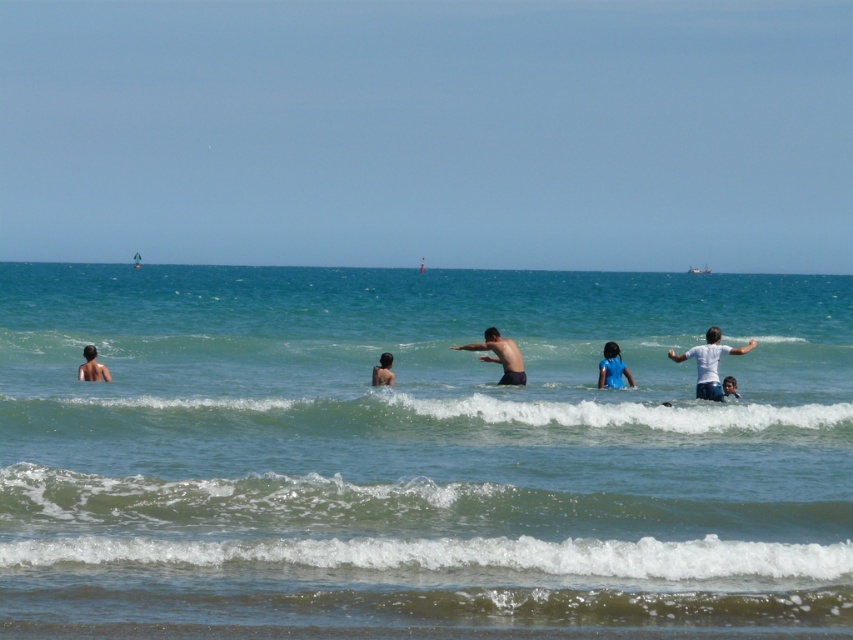
From the picture: Measure the distance between greenish-blue water at center and matte skin person at left.

They are 16.96 feet apart.

Between greenish-blue water at center and matte skin person at left, which one appears on the left side from the viewer's perspective?

matte skin person at left

You are a GUI agent. You are given a task and a screenshot of the screen. Output one action in this format:
    pyautogui.click(x=<x>, y=<y>)
    Task: Click on the greenish-blue water at center
    The image size is (853, 640).
    Given the screenshot: What is the action you would take?
    pyautogui.click(x=416, y=419)

What are the coordinates of `greenish-blue water at center` in the screenshot? It's located at (416, 419).

Is point (519, 381) farther from viewer compared to point (601, 376)?

Yes.

Is dark skin surfer at center shorter than blue matte swimsuit at center?

No.

Which is behind, point (491, 339) or point (628, 372)?

Positioned behind is point (491, 339).

Locate an element on the screen. dark skin surfer at center is located at coordinates (498, 355).

Who is more forward, [592,390] or [378,378]?

Point [378,378] is in front.

At what (x,y) coordinates should I click in order to perform the action: click on greenish-blue water at center. Please return your answer as a coordinate pair (x, y). The image size is (853, 640). Looking at the image, I should click on (416, 419).

Image resolution: width=853 pixels, height=640 pixels. Find the location of `greenish-blue water at center`. greenish-blue water at center is located at coordinates (416, 419).